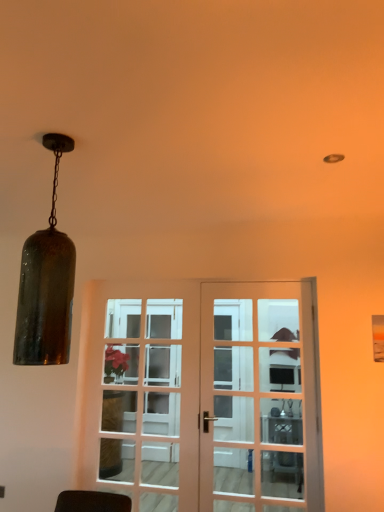
Question: Is amber glass pendant light at left closer to camera compared to matte white door at center, which appears as the 1th door when viewed from the right?

Choices:
 (A) yes
 (B) no

Answer: (A)

Question: Is amber glass pendant light at left to the left of matte white door at center, which appears as the 1th door when viewed from the right, from the viewer's perspective?

Choices:
 (A) no
 (B) yes

Answer: (B)

Question: Is amber glass pendant light at left touching matte white door at center, which appears as the 1th door when viewed from the right?

Choices:
 (A) yes
 (B) no

Answer: (B)

Question: Does amber glass pendant light at left have a larger size compared to matte white door at center, which appears as the 1th door when viewed from the right?

Choices:
 (A) no
 (B) yes

Answer: (B)

Question: Does amber glass pendant light at left lie behind matte white door at center, which appears as the 1th door when viewed from the right?

Choices:
 (A) no
 (B) yes

Answer: (A)

Question: From a real-world perspective, relative to amber glass pendant light at left, is matte white door at center, which appears as the 1th door when viewed from the right, vertically above or below?

Choices:
 (A) below
 (B) above

Answer: (A)

Question: In terms of size, does matte white door at center, which appears as the 1th door when viewed from the right, appear bigger or smaller than amber glass pendant light at left?

Choices:
 (A) big
 (B) small

Answer: (B)

Question: Looking at their shapes, would you say matte white door at center, marked as the second door in a left-to-right arrangement, is wider or thinner than amber glass pendant light at left?

Choices:
 (A) wide
 (B) thin

Answer: (B)

Question: Does point (284, 382) appear closer or farther from the camera than point (33, 293)?

Choices:
 (A) farther
 (B) closer

Answer: (A)

Question: From a real-world perspective, relative to metallic silver table at center, is matte white door at center, which appears as the 1th door when viewed from the right, vertically above or below?

Choices:
 (A) below
 (B) above

Answer: (B)

Question: Considering their positions, is matte white door at center, marked as the second door in a left-to-right arrangement, located in front of or behind metallic silver table at center?

Choices:
 (A) behind
 (B) front

Answer: (B)

Question: Considering the positions of matte white door at center, marked as the second door in a left-to-right arrangement, and metallic silver table at center in the image, is matte white door at center, marked as the second door in a left-to-right arrangement, bigger or smaller than metallic silver table at center?

Choices:
 (A) small
 (B) big

Answer: (A)

Question: Does point (215, 441) appear closer or farther from the camera than point (281, 433)?

Choices:
 (A) farther
 (B) closer

Answer: (B)

Question: Is white glass screen door at center bigger or smaller than matte white door at center, which appears as the 1th door when viewed from the right?

Choices:
 (A) big
 (B) small

Answer: (A)

Question: From a real-world perspective, is white glass screen door at center above or below matte white door at center, marked as the second door in a left-to-right arrangement?

Choices:
 (A) below
 (B) above

Answer: (A)